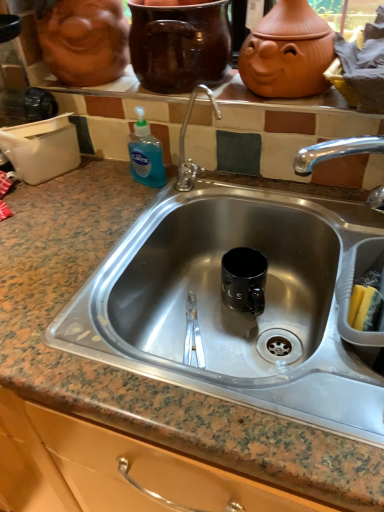
Question: Does marble granite sink at center have a smaller size compared to matte ceramic face at upper left?

Choices:
 (A) yes
 (B) no

Answer: (B)

Question: Is matte ceramic face at upper left at the back of marble granite sink at center?

Choices:
 (A) no
 (B) yes

Answer: (A)

Question: Is marble granite sink at center wider than matte ceramic face at upper left?

Choices:
 (A) no
 (B) yes

Answer: (B)

Question: Considering the relative positions of marble granite sink at center and matte ceramic face at upper left in the image provided, is marble granite sink at center to the left of matte ceramic face at upper left from the viewer's perspective?

Choices:
 (A) no
 (B) yes

Answer: (A)

Question: Can you confirm if marble granite sink at center is bigger than matte ceramic face at upper left?

Choices:
 (A) yes
 (B) no

Answer: (A)

Question: From a real-world perspective, is glossy ceramic mug at upper center above or below matte ceramic pots at upper center?

Choices:
 (A) above
 (B) below

Answer: (A)

Question: Do you think glossy ceramic mug at upper center is within matte ceramic pots at upper center, or outside of it?

Choices:
 (A) outside
 (B) inside

Answer: (A)

Question: Looking at their shapes, would you say glossy ceramic mug at upper center is wider or thinner than matte ceramic pots at upper center?

Choices:
 (A) thin
 (B) wide

Answer: (B)

Question: Based on their sizes in the image, would you say glossy ceramic mug at upper center is bigger or smaller than matte ceramic pots at upper center?

Choices:
 (A) small
 (B) big

Answer: (B)

Question: In terms of height, does matte ceramic pots at upper center look taller or shorter compared to glossy ceramic mug at upper center?

Choices:
 (A) tall
 (B) short

Answer: (B)

Question: Considering the relative positions of matte ceramic pots at upper center and glossy ceramic mug at upper center in the image provided, is matte ceramic pots at upper center to the left or to the right of glossy ceramic mug at upper center?

Choices:
 (A) right
 (B) left

Answer: (A)

Question: Do you think matte ceramic pots at upper center is within glossy ceramic mug at upper center, or outside of it?

Choices:
 (A) outside
 (B) inside

Answer: (A)

Question: From the image's perspective, is matte ceramic pots at upper center positioned above or below glossy ceramic mug at upper center?

Choices:
 (A) below
 (B) above

Answer: (A)

Question: From the image's perspective, relative to marble granite sink at center, is glossy ceramic mug at upper center above or below?

Choices:
 (A) below
 (B) above

Answer: (B)

Question: From a real-world perspective, is glossy ceramic mug at upper center physically located above or below marble granite sink at center?

Choices:
 (A) below
 (B) above

Answer: (B)